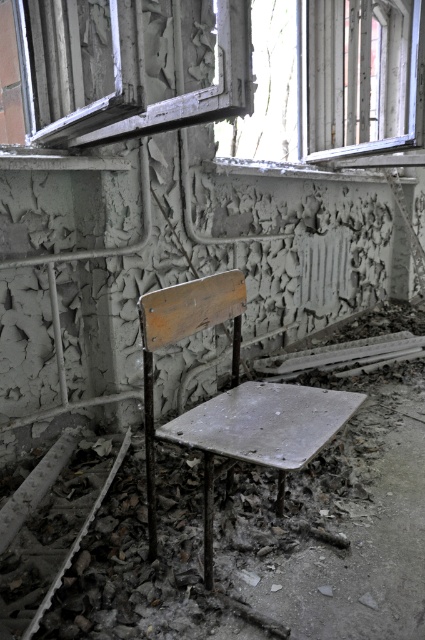
Question: Which object is the farthest from the wooden chair at center?

Choices:
 (A) transparent glass window at upper center
 (B) white textured frame at upper left

Answer: (A)

Question: Does transparent glass window at upper center have a greater width compared to white textured frame at upper left?

Choices:
 (A) no
 (B) yes

Answer: (B)

Question: Which point appears farthest from the camera in this image?

Choices:
 (A) (x=209, y=422)
 (B) (x=138, y=70)

Answer: (A)

Question: Which object is farther from the camera taking this photo?

Choices:
 (A) wooden chair at center
 (B) white textured frame at upper left
 (C) transparent glass window at upper center

Answer: (C)

Question: Can you confirm if transparent glass window at upper center is positioned above wooden chair at center?

Choices:
 (A) no
 (B) yes

Answer: (B)

Question: Does white textured frame at upper left have a larger size compared to wooden chair at center?

Choices:
 (A) yes
 (B) no

Answer: (A)